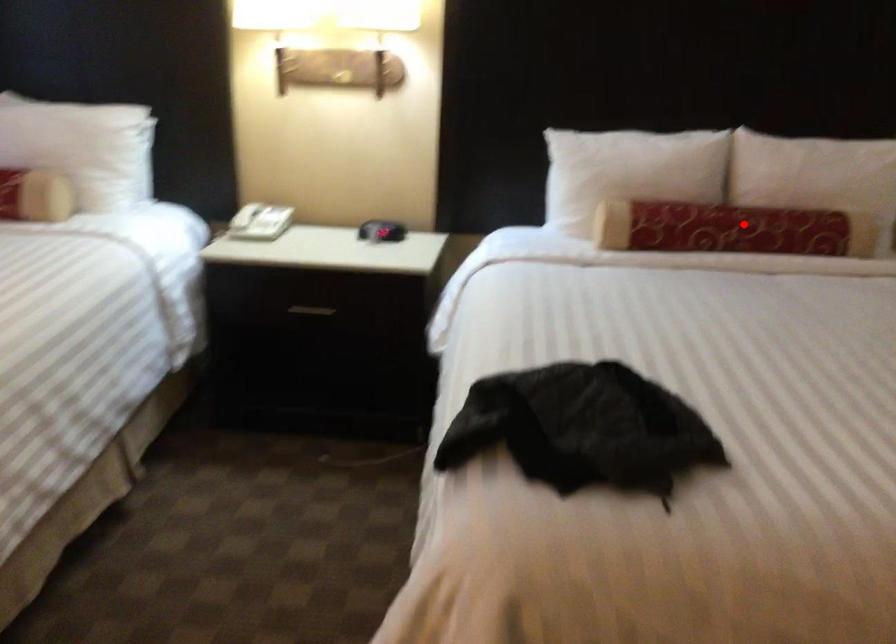
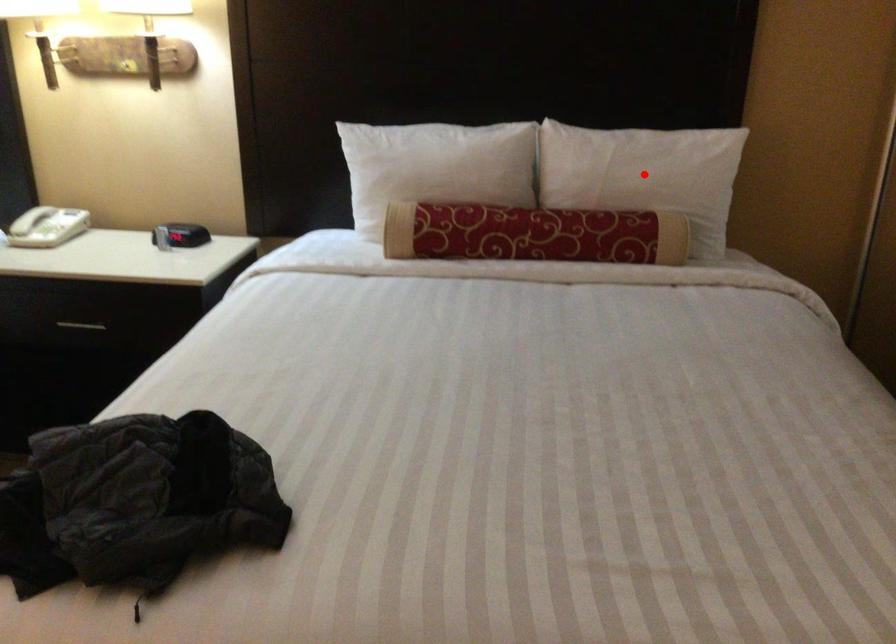
I am providing you with two images of the same scene from different viewpoints. A red point is marked on the first image and another point is marked on the second image. Do the highlighted points in image1 and image2 indicate the same real-world spot?

No